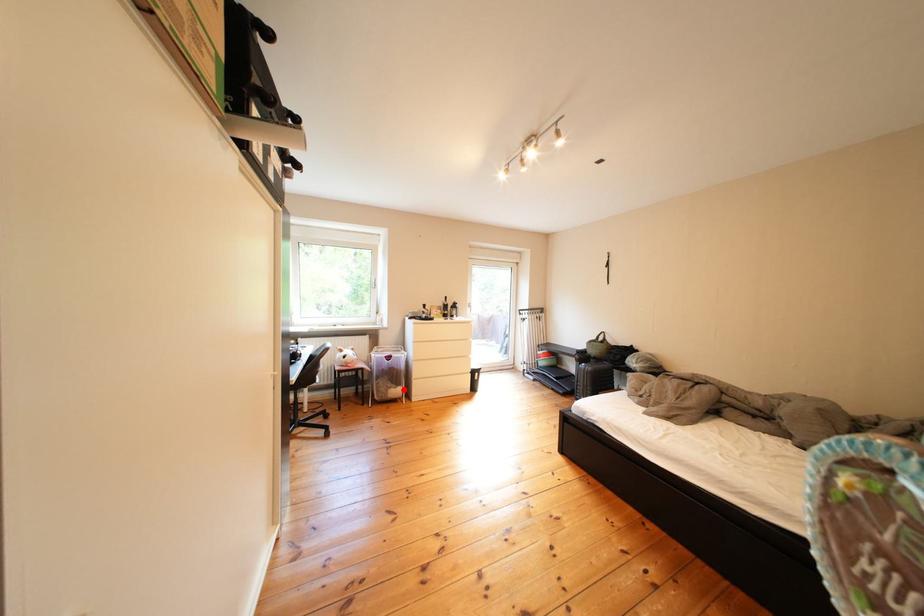
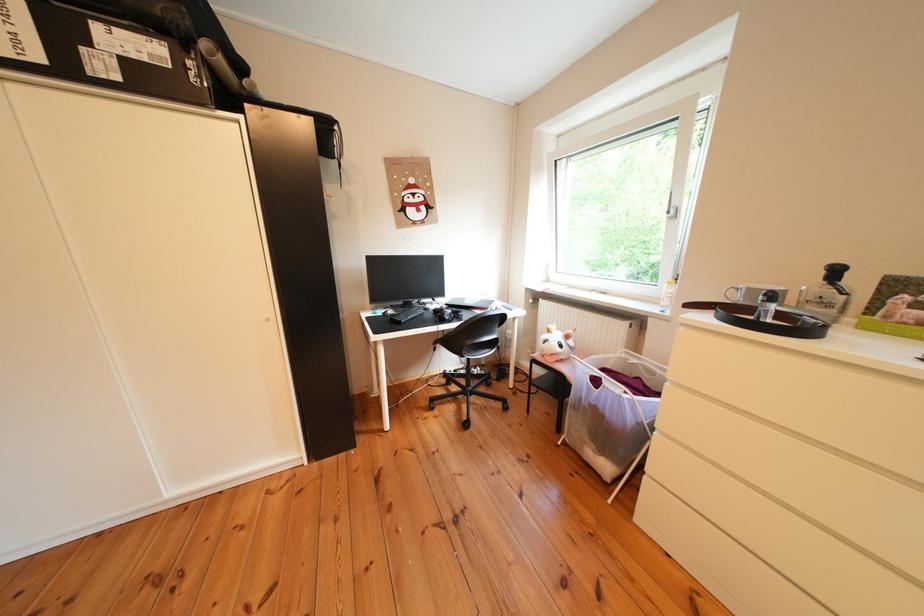
Where in the second image is the point corresponding to the highlighted location from the first image?

(601, 442)